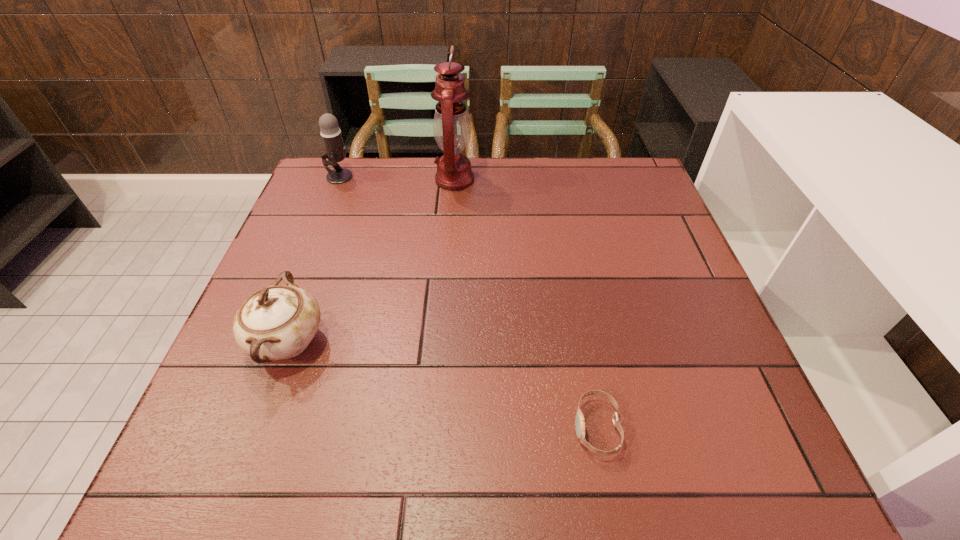
This screenshot has height=540, width=960. What are the coordinates of `oil lamp` in the screenshot? It's located at (452, 129).

Image resolution: width=960 pixels, height=540 pixels. In order to click on the tallest object in this screenshot , I will do `click(452, 129)`.

Image resolution: width=960 pixels, height=540 pixels. In order to click on the second tallest object in this screenshot , I will do `click(331, 135)`.

At what (x,y) coordinates should I click in order to perform the action: click on the second shortest object. Please return your answer as a coordinate pair (x, y). This screenshot has width=960, height=540. Looking at the image, I should click on (278, 322).

Locate an element on the screen. The image size is (960, 540). chinaware is located at coordinates (278, 322).

Find the location of a particular element. The height and width of the screenshot is (540, 960). the shortest object is located at coordinates (579, 419).

Locate an element on the screen. The width and height of the screenshot is (960, 540). watch is located at coordinates (579, 419).

Image resolution: width=960 pixels, height=540 pixels. What are the coordinates of `free point located 0.140m on the right of the third object from left to right` in the screenshot? It's located at (521, 180).

The width and height of the screenshot is (960, 540). Find the location of `free space located on the right of the microphone`. free space located on the right of the microphone is located at coordinates (484, 177).

Identify the location of free space located on the right of the chinaware. This screenshot has width=960, height=540. (400, 342).